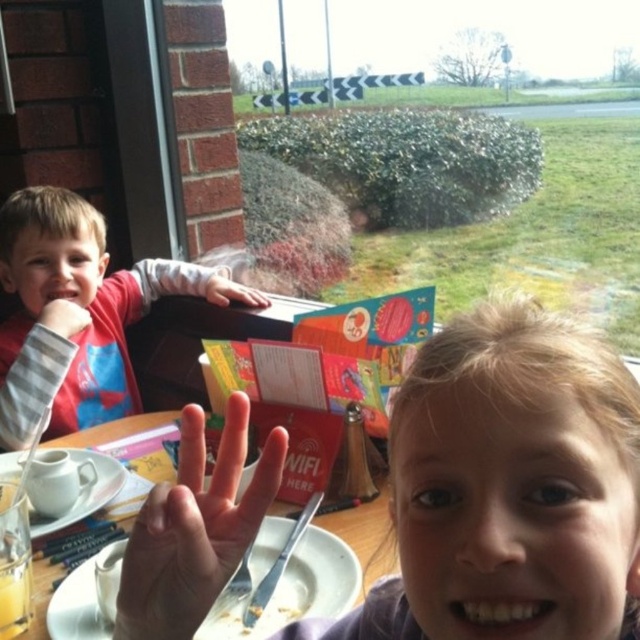
Is point (76, 362) farther from camera compared to point (72, 332)?

Yes, point (76, 362) is farther from viewer.

In the scene shown: Measure the distance between point (0, 346) and camera.

A distance of 4.04 feet exists between point (0, 346) and camera.

Find the location of `matte red shirt at left`. matte red shirt at left is located at coordinates (77, 304).

Is white matte plate at lower center taller than smooth gray wristband at left?

Incorrect, white matte plate at lower center's height is not larger of smooth gray wristband at left's.

Is point (269, 561) positioned in front of point (51, 320)?

Yes, point (269, 561) is in front of point (51, 320).

Where is `white matte plate at lower center`? The image size is (640, 640). white matte plate at lower center is located at coordinates (320, 577).

Is matte red shirt at left below smooth skin hand at upper left?

Correct, matte red shirt at left is located below smooth skin hand at upper left.

This screenshot has height=640, width=640. I want to click on matte red shirt at left, so click(x=77, y=304).

Between point (44, 186) and point (211, 294), which one is positioned behind?

The point (44, 186) is behind.

Image resolution: width=640 pixels, height=640 pixels. Find the location of `matte red shirt at left`. matte red shirt at left is located at coordinates (77, 304).